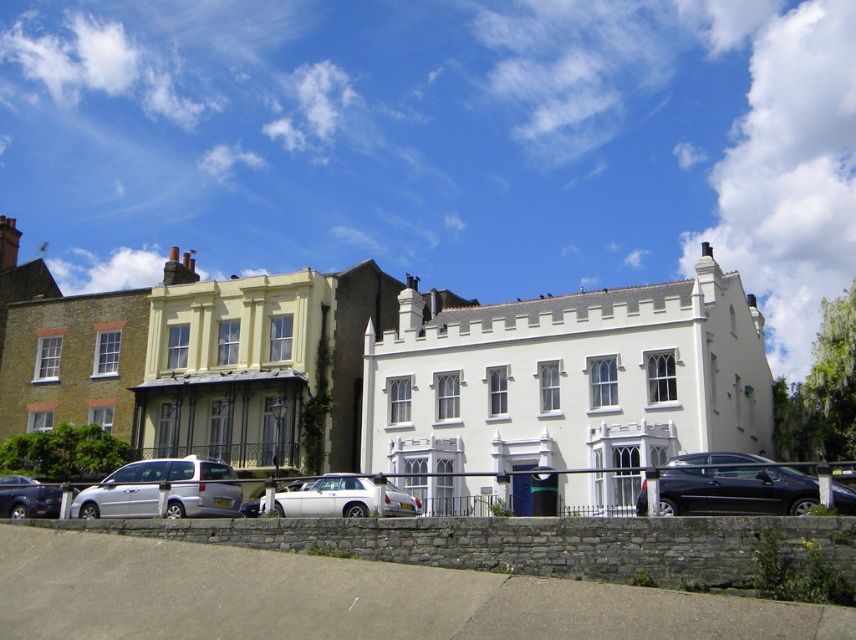
Question: Can you confirm if silver metallic van at lower left is positioned below white glossy sedan at center?

Choices:
 (A) no
 (B) yes

Answer: (A)

Question: Which of the following is the farthest from the observer?

Choices:
 (A) (331, 502)
 (B) (10, 483)
 (C) (200, 481)

Answer: (B)

Question: Can you confirm if white glossy sedan at center is smaller than shiny black sedan at lower left?

Choices:
 (A) yes
 (B) no

Answer: (B)

Question: Which point is farther from the camera taking this photo?

Choices:
 (A) (324, 516)
 (B) (56, 492)

Answer: (B)

Question: Is silver metallic van at lower left to the right of shiny black sedan at lower left from the viewer's perspective?

Choices:
 (A) yes
 (B) no

Answer: (A)

Question: Estimate the real-world distances between objects in this image. Which object is closer to the shiny black sedan at center right?

Choices:
 (A) shiny black sedan at lower left
 (B) silver metallic van at lower left

Answer: (B)